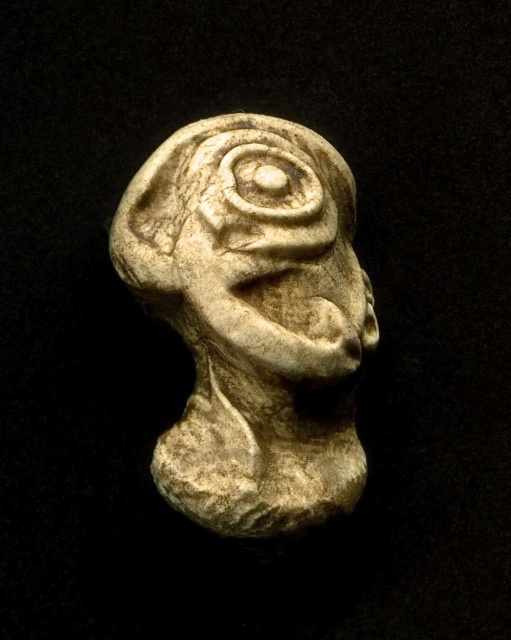
You are an archaeologist examining the sculpture. You notice two parts labeled as the white stone head at center and the white stone face at center. Since they are close to each other, can you tell me how far apart they are?

The white stone head at center and white stone face at center are 1.11 inches apart.